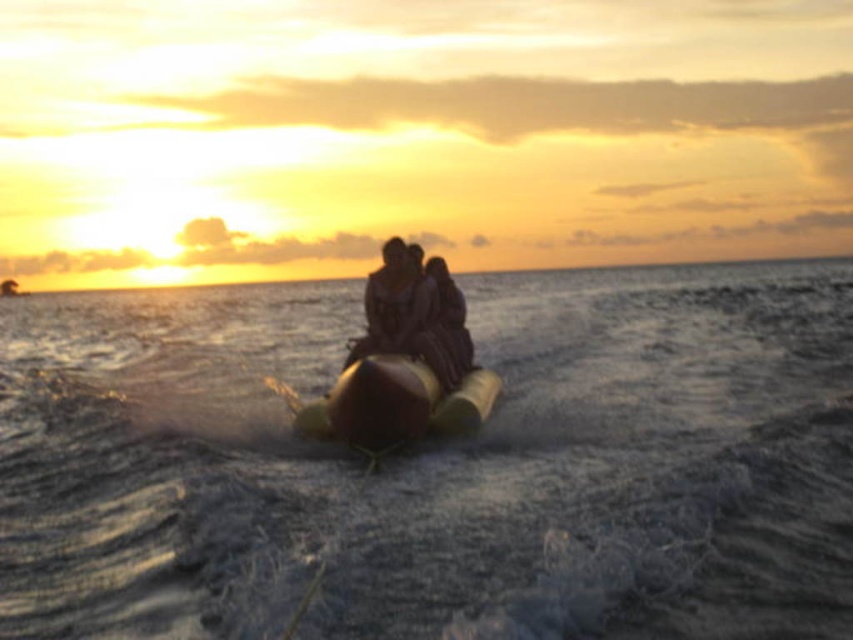
Question: Does yellow rubber boat at center have a lesser width compared to smooth yellow banana boat at center?

Choices:
 (A) yes
 (B) no

Answer: (B)

Question: Which of the following is the farthest from the observer?

Choices:
 (A) [560, 410]
 (B) [471, 340]

Answer: (A)

Question: Which object is closer to the camera taking this photo?

Choices:
 (A) yellow rubber boat at center
 (B) smooth yellow banana boat at center
 (C) translucent rubber water at center

Answer: (C)

Question: Which object is closer to the camera taking this photo?

Choices:
 (A) translucent rubber water at center
 (B) yellow rubber boat at center

Answer: (A)

Question: Does yellow rubber boat at center appear under smooth yellow banana boat at center?

Choices:
 (A) no
 (B) yes

Answer: (B)

Question: Can you confirm if translucent rubber water at center is wider than yellow rubber boat at center?

Choices:
 (A) no
 (B) yes

Answer: (B)